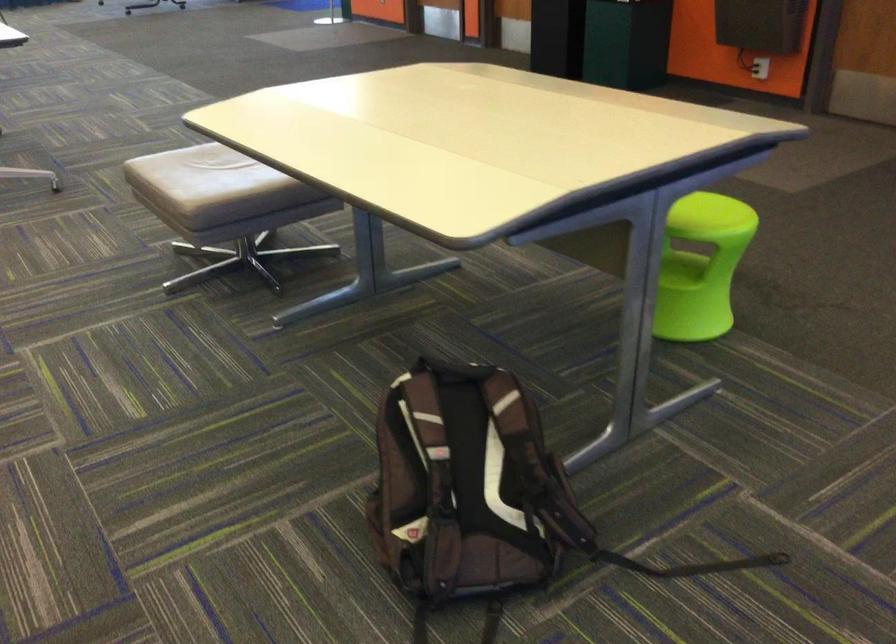
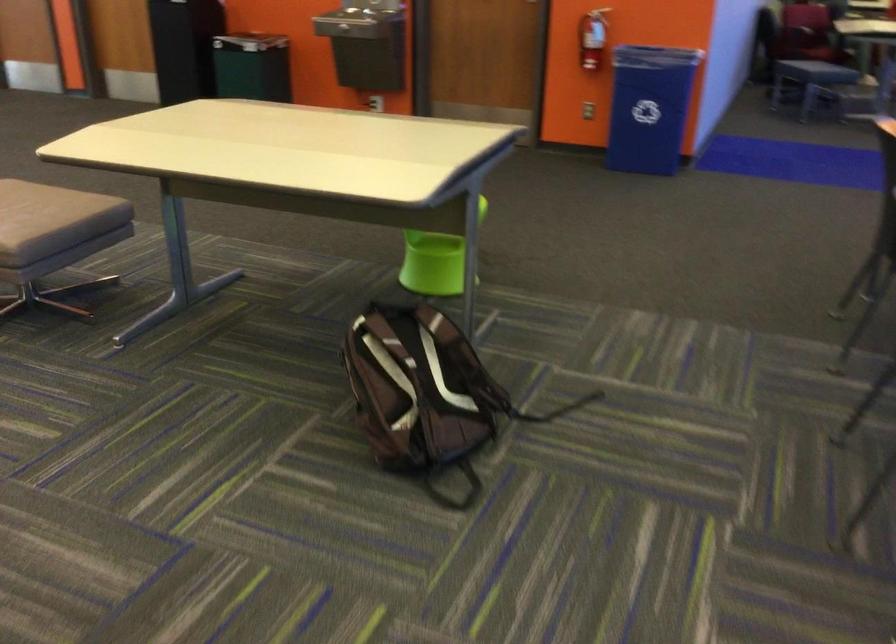
In the second image, find the point that corresponds to the point at 245,166 in the first image.

(39, 203)